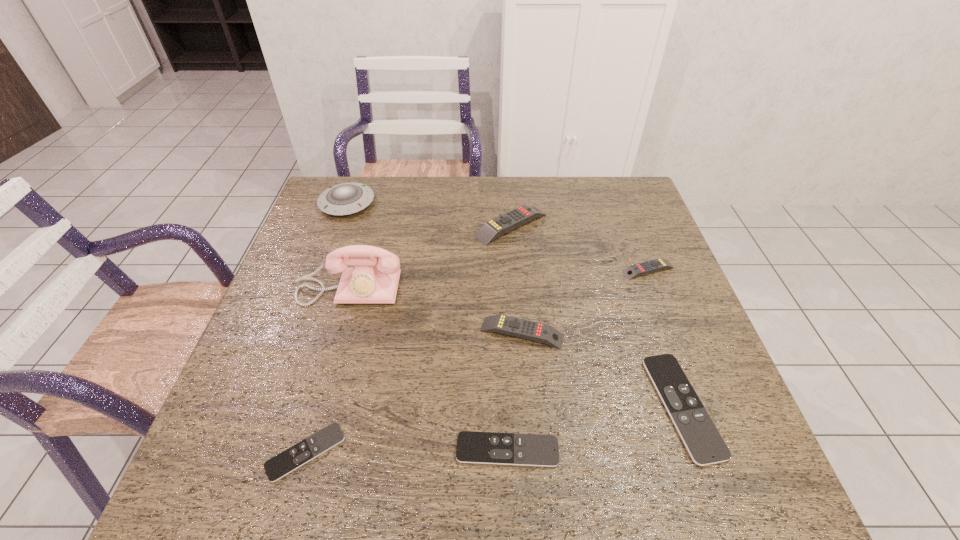
Locate an element on the screen. This screenshot has height=540, width=960. empty location between the saucer and the rightmost black remote control is located at coordinates tap(515, 305).

The image size is (960, 540). I want to click on empty space that is in between the second shortest object and the pink telephone, so click(428, 369).

Where is `vacant region between the second shortest remote control and the tallest object`? The width and height of the screenshot is (960, 540). vacant region between the second shortest remote control and the tallest object is located at coordinates (428, 369).

This screenshot has height=540, width=960. I want to click on vacant area between the second black remote control from left to right and the pink telephone, so click(428, 369).

Locate an element on the screen. free space between the biggest black remote control and the shortest remote control is located at coordinates (494, 429).

Identify the location of free spot between the shortest remote control and the biggest black remote control. (494, 429).

Find the location of a particular element. The height and width of the screenshot is (540, 960). free area in between the second black remote control from right to left and the saucer is located at coordinates (427, 327).

Select which object appears as the third closest to the seventh shortest object. Please provide its 2D coordinates. Your answer should be formatted as a tuple, i.e. [(x, y)], where the tuple contains the x and y coordinates of a point satisfying the conditions above.

[(521, 328)]

Identify which object is the sixth closest to the second tallest object. Please provide its 2D coordinates. Your answer should be formatted as a tuple, i.e. [(x, y)], where the tuple contains the x and y coordinates of a point satisfying the conditions above.

[(472, 447)]

This screenshot has width=960, height=540. In order to click on remote control that is the second closest to the seventh shortest object in this screenshot , I will do `click(521, 328)`.